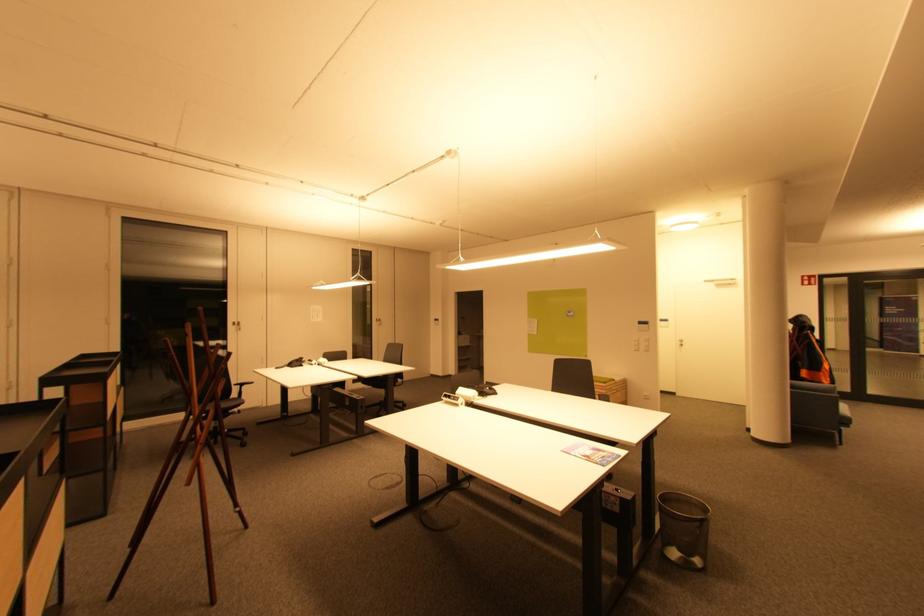
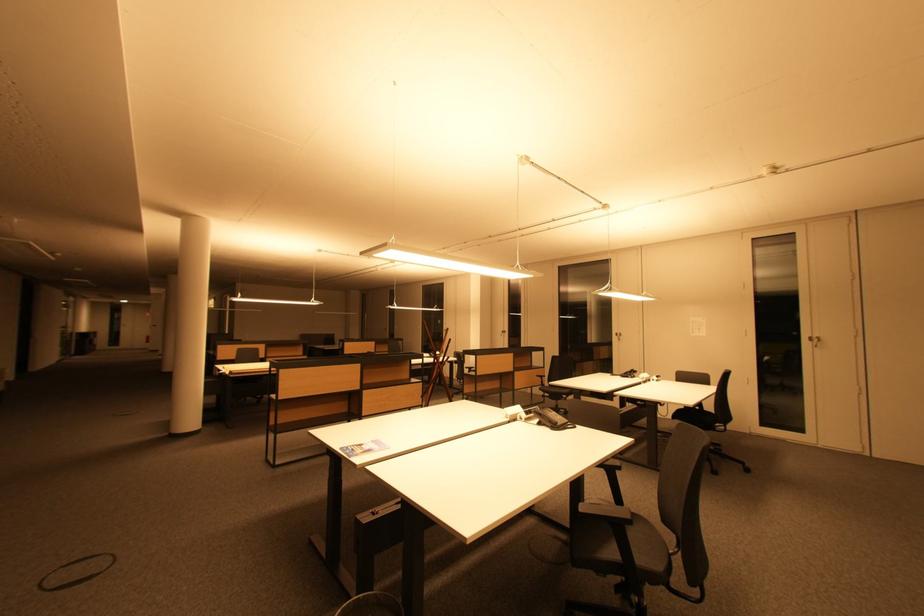
Find the pixel in the second image that matches point (300, 365) in the first image.

(635, 376)